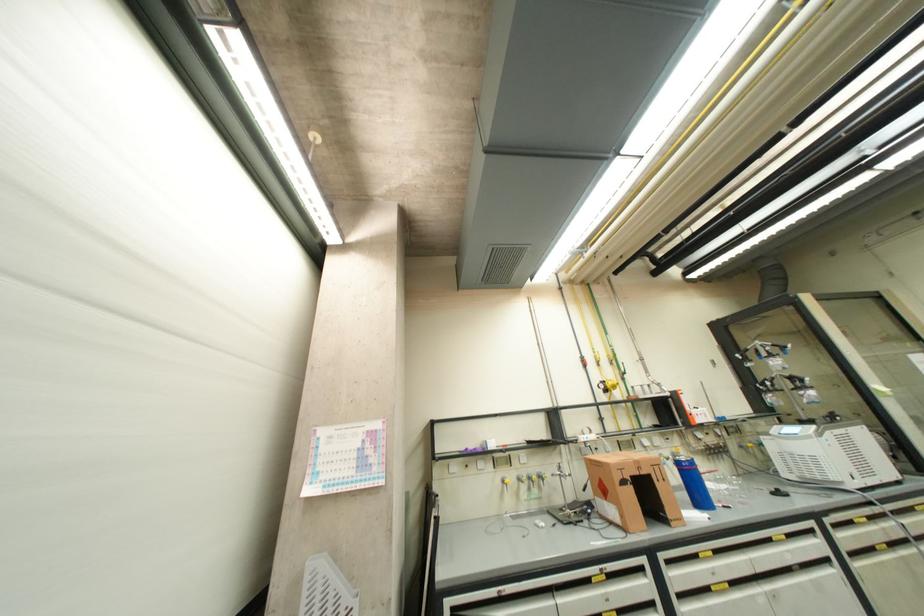
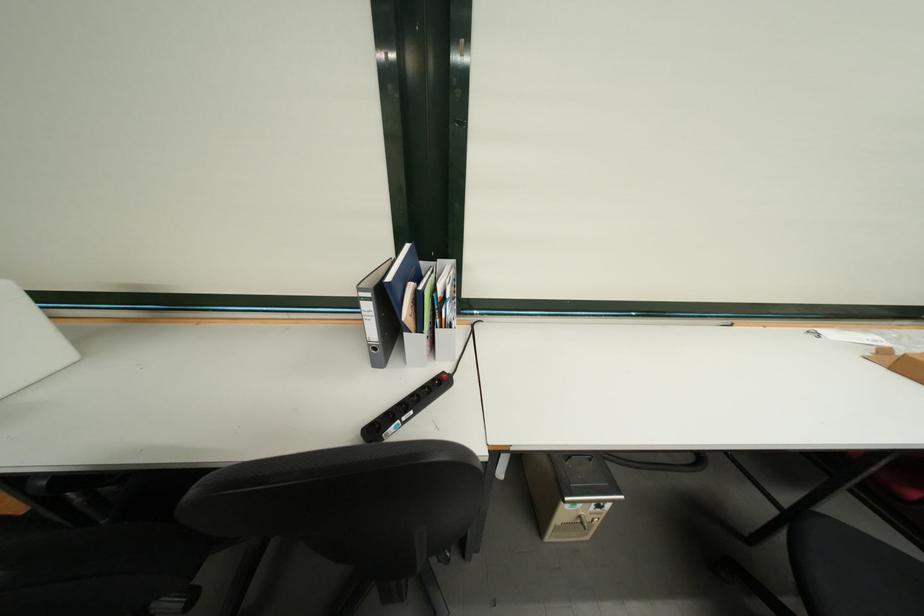
Based on the continuous images, in which direction is the camera rotating?

The camera's rotation is toward left-down.